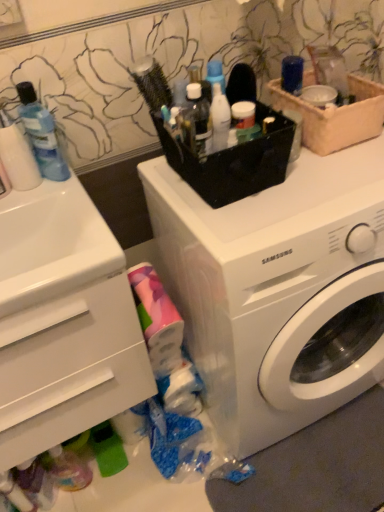
The image size is (384, 512). I want to click on free space in front of beige woven basket at upper right, so click(341, 174).